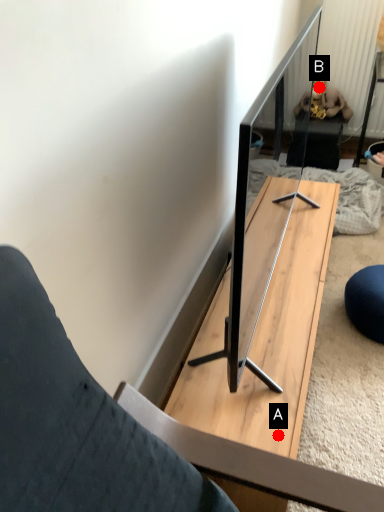
Question: Two points are circled on the image, labeled by A and B beside each circle. Which of the following is the closest to the observer?

Choices:
 (A) A is closer
 (B) B is closer

Answer: (A)